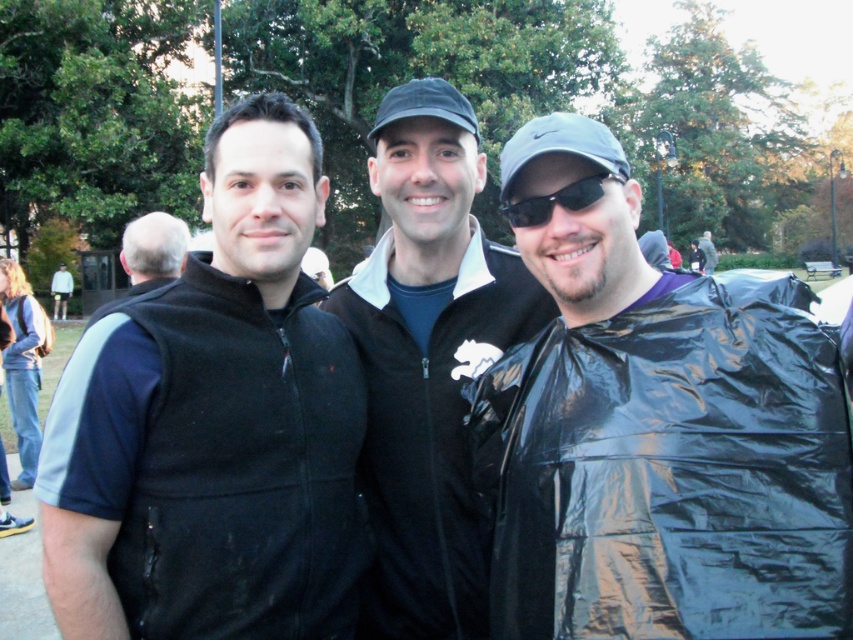
You are a delivery person holding a package that is 1.5 meters long. You need to hand it to the person standing near the glossy plastic bag at right. Can you safely pass the package without it hitting anything or anyone?

The distance between the glossy plastic bag at right and the viewer is 1.48 meters. Since the package is 1.5 meters long, it might not fit within the available space, so there is a risk of it hitting something or someone during the transfer.

You are a photographer trying to capture a group photo of the gray hair at left and the light gray hoodie at upper left. Which object should you focus on first if you want to ensure both are in focus?

The gray hair at left is wider than the light gray hoodie at upper left, so focusing on the wider object first would help ensure both are in focus.

You are organizing a small event and need to distribute items. You have a glossy plastic bag at right and black plastic goggles at center. Which item can hold more promotional materials?

The glossy plastic bag at right can hold more promotional materials since it is bigger than the black plastic goggles at center.